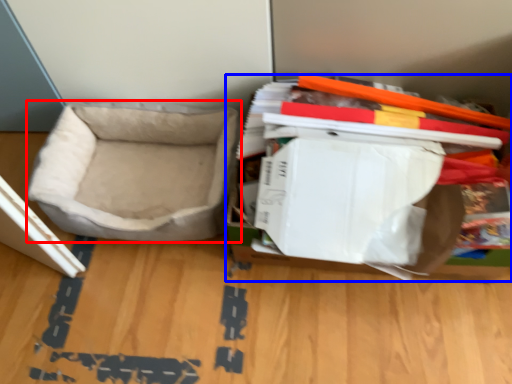
Question: Which object is further to the camera taking this photo, dog bed (highlighted by a red box) or storage box (highlighted by a blue box)?

Choices:
 (A) dog bed
 (B) storage box

Answer: (A)